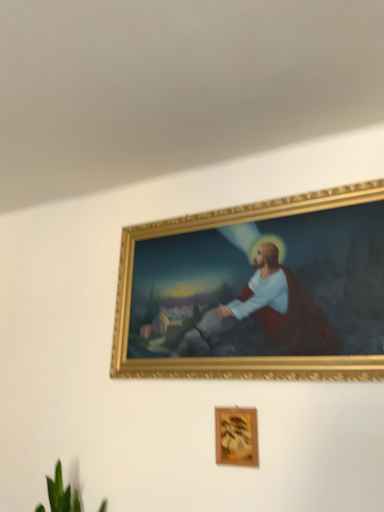
Question: Considering the relative positions of gold/gilded picture frame at upper center, acting as the 2th picture frame starting from the bottom, and green leafy plant at lower left in the image provided, is gold/gilded picture frame at upper center, acting as the 2th picture frame starting from the bottom, to the right of green leafy plant at lower left from the viewer's perspective?

Choices:
 (A) no
 (B) yes

Answer: (B)

Question: Is gold/gilded picture frame at upper center, positioned as the 1th picture frame in top-to-bottom order, positioned far away from green leafy plant at lower left?

Choices:
 (A) yes
 (B) no

Answer: (B)

Question: Can you confirm if gold/gilded picture frame at upper center, positioned as the 1th picture frame in top-to-bottom order, is bigger than green leafy plant at lower left?

Choices:
 (A) no
 (B) yes

Answer: (B)

Question: Is gold/gilded picture frame at upper center, acting as the 2th picture frame starting from the bottom, taller than green leafy plant at lower left?

Choices:
 (A) yes
 (B) no

Answer: (A)

Question: From a real-world perspective, is gold/gilded picture frame at upper center, acting as the 2th picture frame starting from the bottom, positioned over green leafy plant at lower left based on gravity?

Choices:
 (A) yes
 (B) no

Answer: (A)

Question: Is gold/gilded picture frame at upper center, acting as the 2th picture frame starting from the bottom, oriented towards green leafy plant at lower left?

Choices:
 (A) no
 (B) yes

Answer: (A)

Question: Does gold/gilded picture frame at upper center, acting as the 2th picture frame starting from the bottom, lie behind wooden frame at lower center, which is the first picture frame in left-to-right order?

Choices:
 (A) no
 (B) yes

Answer: (A)

Question: Is wooden frame at lower center, which is the first picture frame in left-to-right order, at the back of gold/gilded picture frame at upper center, positioned as the second picture frame in left-to-right order?

Choices:
 (A) no
 (B) yes

Answer: (A)

Question: Is gold/gilded picture frame at upper center, positioned as the second picture frame in left-to-right order, facing towards wooden frame at lower center, positioned as the second picture frame in top-to-bottom order?

Choices:
 (A) no
 (B) yes

Answer: (A)

Question: From a real-world perspective, is gold/gilded picture frame at upper center, which is the first picture frame from right to left, positioned under wooden frame at lower center, arranged as the first picture frame when ordered from the bottom, based on gravity?

Choices:
 (A) yes
 (B) no

Answer: (B)

Question: From a real-world perspective, is gold/gilded picture frame at upper center, acting as the 2th picture frame starting from the bottom, located higher than wooden frame at lower center, placed as the second picture frame when sorted from right to left?

Choices:
 (A) yes
 (B) no

Answer: (A)

Question: Can you confirm if gold/gilded picture frame at upper center, positioned as the 1th picture frame in top-to-bottom order, is bigger than wooden frame at lower center, placed as the second picture frame when sorted from right to left?

Choices:
 (A) yes
 (B) no

Answer: (A)